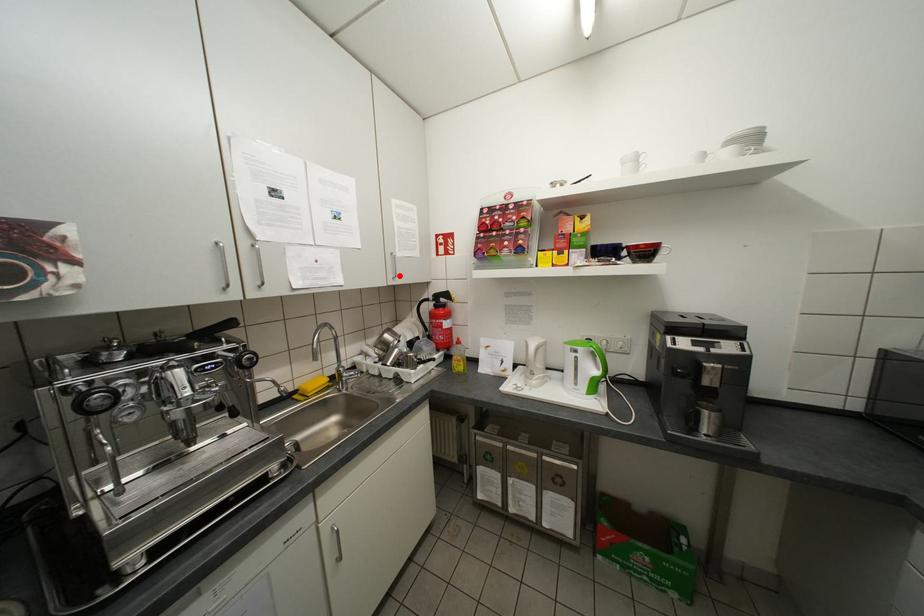
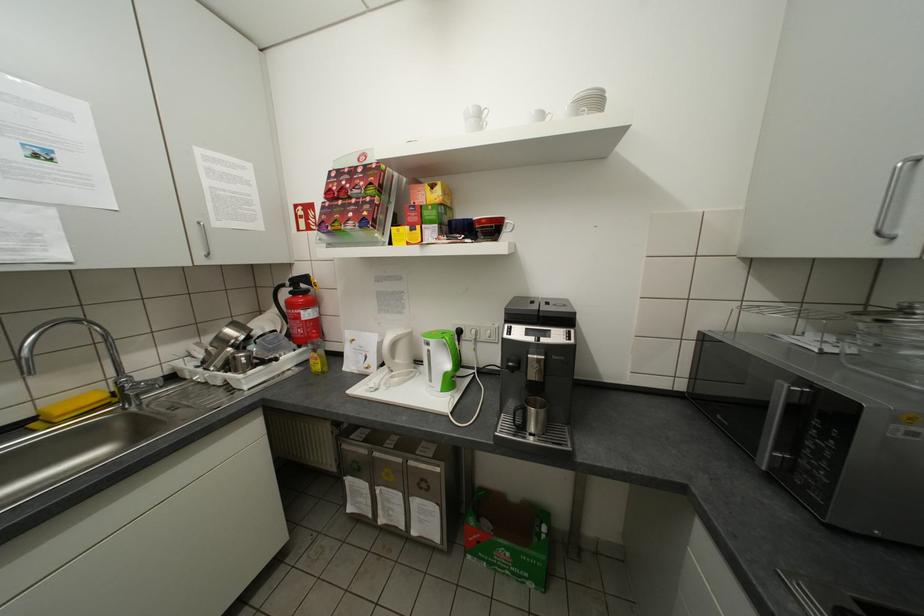
In the second image, find the point that corresponds to the highlighted location in the first image.

(209, 253)